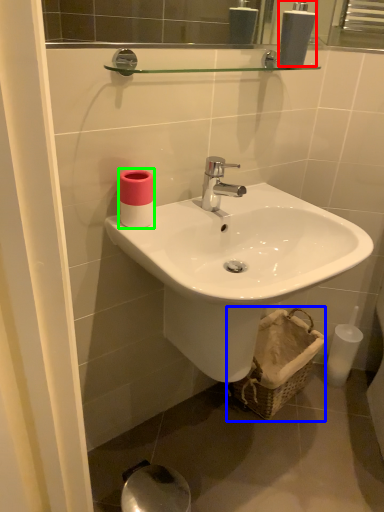
Question: Which object is the farthest from soap dispenser (highlighted by a red box)? Choose among these: basket (highlighted by a blue box) or toiletry (highlighted by a green box).

Choices:
 (A) basket
 (B) toiletry

Answer: (A)